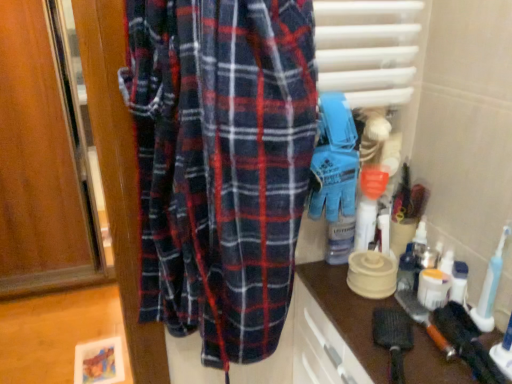
Question: Considering the relative sizes of black rubber toothbrush at lower right and brown matte countertop at lower right in the image provided, is black rubber toothbrush at lower right bigger than brown matte countertop at lower right?

Choices:
 (A) yes
 (B) no

Answer: (B)

Question: Does black rubber toothbrush at lower right have a lesser width compared to brown matte countertop at lower right?

Choices:
 (A) yes
 (B) no

Answer: (A)

Question: Can you confirm if black rubber toothbrush at lower right is positioned to the right of brown matte countertop at lower right?

Choices:
 (A) no
 (B) yes

Answer: (B)

Question: Is black rubber toothbrush at lower right touching brown matte countertop at lower right?

Choices:
 (A) no
 (B) yes

Answer: (A)

Question: Considering the relative positions of black rubber toothbrush at lower right and brown matte countertop at lower right in the image provided, is black rubber toothbrush at lower right to the left of brown matte countertop at lower right from the viewer's perspective?

Choices:
 (A) no
 (B) yes

Answer: (A)

Question: Does black rubber toothbrush at lower right lie in front of brown matte countertop at lower right?

Choices:
 (A) no
 (B) yes

Answer: (A)

Question: From the image's perspective, is brown matte countertop at lower right located beneath black rubber toothbrush at lower right?

Choices:
 (A) no
 (B) yes

Answer: (B)

Question: Can you confirm if brown matte countertop at lower right is thinner than black rubber toothbrush at lower right?

Choices:
 (A) yes
 (B) no

Answer: (B)

Question: Can you confirm if brown matte countertop at lower right is taller than black rubber toothbrush at lower right?

Choices:
 (A) yes
 (B) no

Answer: (A)

Question: Does brown matte countertop at lower right appear on the right side of black rubber toothbrush at lower right?

Choices:
 (A) no
 (B) yes

Answer: (A)

Question: Is brown matte countertop at lower right far away from black rubber toothbrush at lower right?

Choices:
 (A) no
 (B) yes

Answer: (A)

Question: From a real-world perspective, is brown matte countertop at lower right beneath black rubber toothbrush at lower right?

Choices:
 (A) yes
 (B) no

Answer: (A)

Question: Is blue rubber gloves at center positioned far away from black rubber toothbrush at lower right?

Choices:
 (A) yes
 (B) no

Answer: (B)